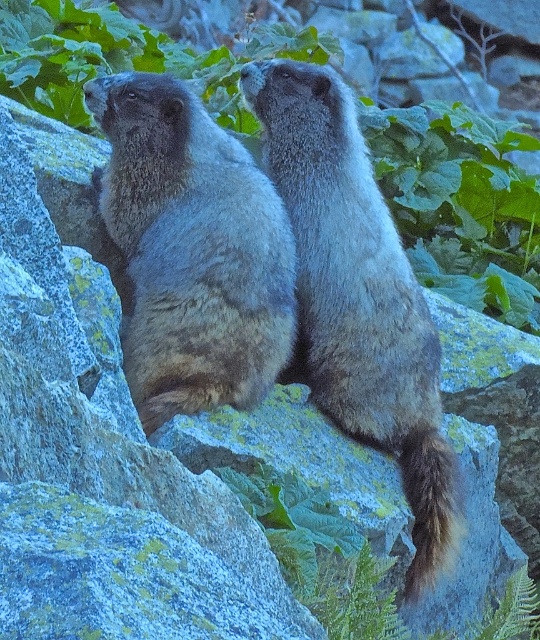
From the picture: You are a photographer trying to capture both the fuzzy brown groundhog at center and the brown furry tail at right in a single shot. Based on their positions, which direction should you move your camera to include both subjects?

Since the fuzzy brown groundhog at center is to the left of the brown furry tail at right, you should move your camera slightly to the left to ensure both subjects are framed within the shot.

You are a photographer trying to capture both the fuzzy brown groundhog at center and the green leafy plant at upper center in a single frame. Based on their sizes, which one should you focus on first to ensure both fit well in the photo?

The fuzzy brown groundhog at center is smaller than the green leafy plant at upper center, so you should focus on the green leafy plant at upper center first to ensure both fit well in the photo.